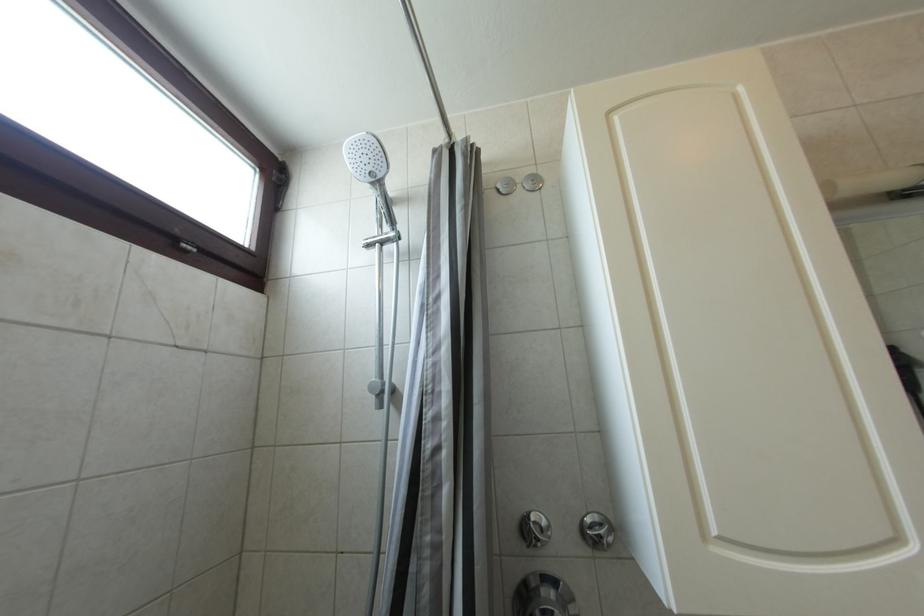
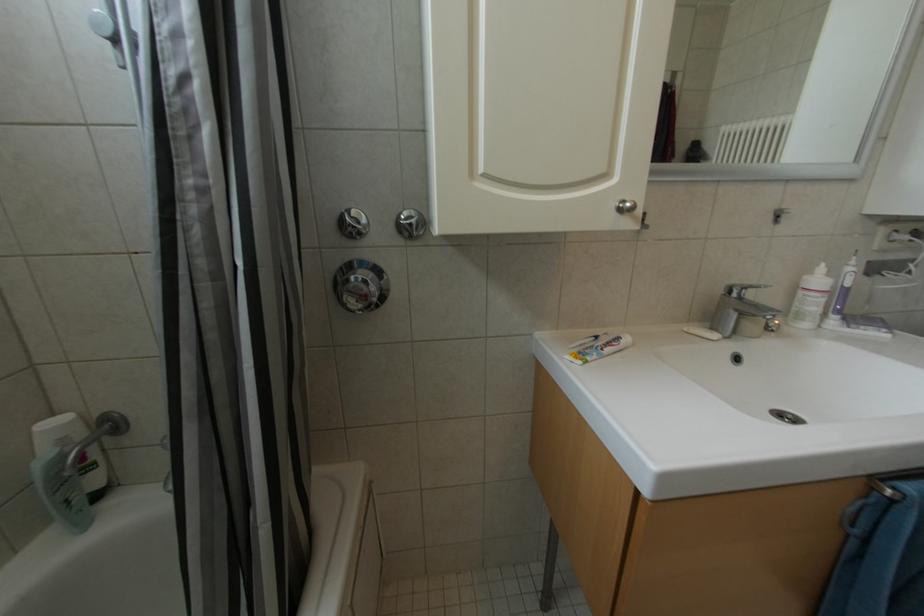
The first image is from the beginning of the video and the second image is from the end. How did the camera likely rotate when shooting the video?

The camera's rotation is toward right-down.